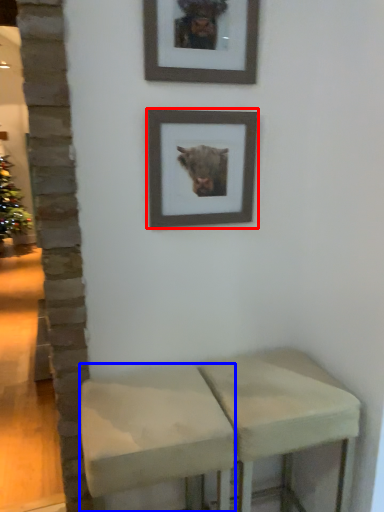
Question: Which object is closer to the camera taking this photo, picture frame (highlighted by a red box) or stool (highlighted by a blue box)?

Choices:
 (A) picture frame
 (B) stool

Answer: (B)